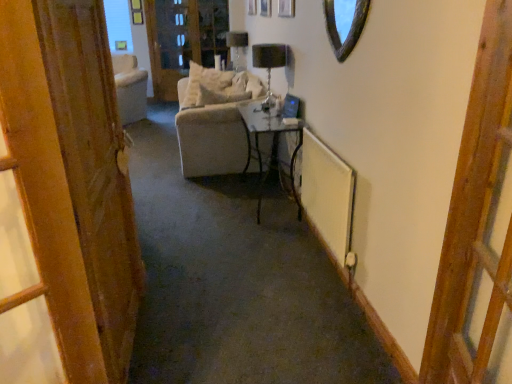
Question: From a real-world perspective, is metallic black table at center positioned under matte black lampshade at upper center, which appears as the 1th lamp when viewed from the left, based on gravity?

Choices:
 (A) yes
 (B) no

Answer: (A)

Question: Is metallic black table at center shorter than matte black lampshade at upper center, which appears as the second lamp when ordered from the bottom?

Choices:
 (A) yes
 (B) no

Answer: (B)

Question: Can you confirm if metallic black table at center is wider than matte black lampshade at upper center, the 2th lamp in the right-to-left sequence?

Choices:
 (A) no
 (B) yes

Answer: (B)

Question: Is metallic black table at center not near matte black lampshade at upper center, which appears as the second lamp when ordered from the bottom?

Choices:
 (A) no
 (B) yes

Answer: (B)

Question: Is metallic black table at center turned away from matte black lampshade at upper center, which appears as the 1th lamp when viewed from the left?

Choices:
 (A) no
 (B) yes

Answer: (A)

Question: Is point (346, 34) positioned closer to the camera than point (336, 157)?

Choices:
 (A) closer
 (B) farther

Answer: (A)

Question: From a real-world perspective, is shiny glass mirror at upper center physically located above or below white matte radiator at right?

Choices:
 (A) below
 (B) above

Answer: (B)

Question: Based on their sizes in the image, would you say shiny glass mirror at upper center is bigger or smaller than white matte radiator at right?

Choices:
 (A) small
 (B) big

Answer: (A)

Question: Is shiny glass mirror at upper center wider or thinner than white matte radiator at right?

Choices:
 (A) wide
 (B) thin

Answer: (B)

Question: Does point (231, 61) appear closer or farther from the camera than point (359, 1)?

Choices:
 (A) farther
 (B) closer

Answer: (A)

Question: From the image's perspective, relative to shiny glass mirror at upper center, is matte black lampshade at upper center, the 2th lamp in the front-to-back sequence, above or below?

Choices:
 (A) above
 (B) below

Answer: (A)

Question: From their relative heights in the image, would you say matte black lampshade at upper center, the 2th lamp in the right-to-left sequence, is taller or shorter than shiny glass mirror at upper center?

Choices:
 (A) tall
 (B) short

Answer: (A)

Question: Is matte black lampshade at upper center, which appears as the 1th lamp when viewed from the left, spatially inside shiny glass mirror at upper center, or outside of it?

Choices:
 (A) inside
 (B) outside

Answer: (B)

Question: In terms of width, does white fabric screen door at upper center look wider or thinner when compared to metallic black table at center?

Choices:
 (A) wide
 (B) thin

Answer: (B)

Question: Does point (190, 54) appear closer or farther from the camera than point (293, 127)?

Choices:
 (A) closer
 (B) farther

Answer: (B)